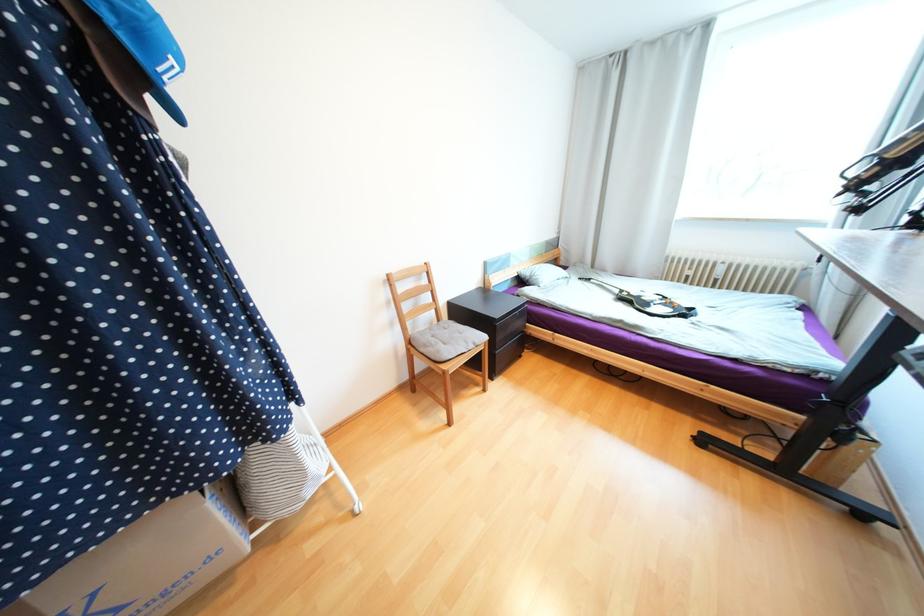
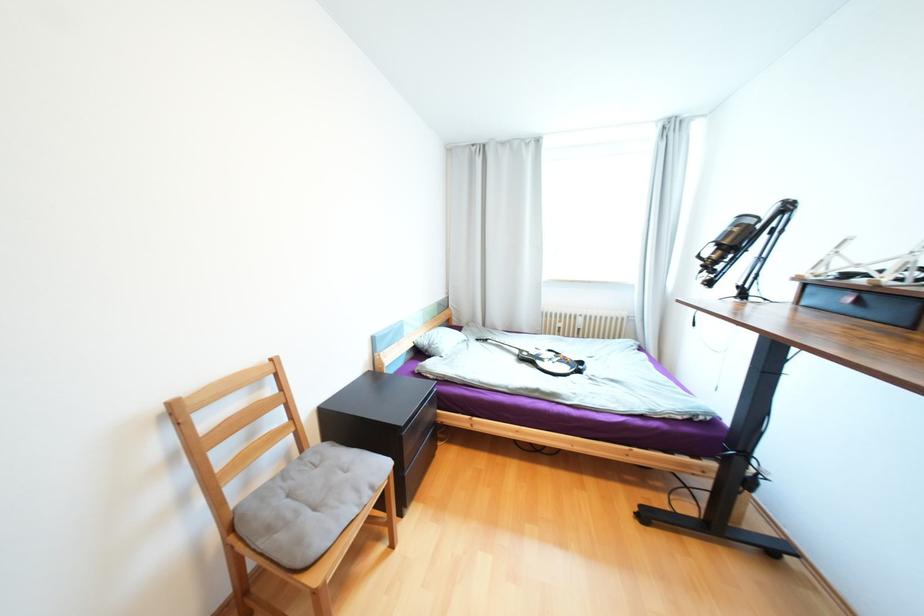
Question: The camera is either moving clockwise (left) or counter-clockwise (right) around the object. The first image is from the beginning of the video and the second image is from the end. Is the camera moving left or right when shooting the video?

Choices:
 (A) Left
 (B) Right

Answer: (A)